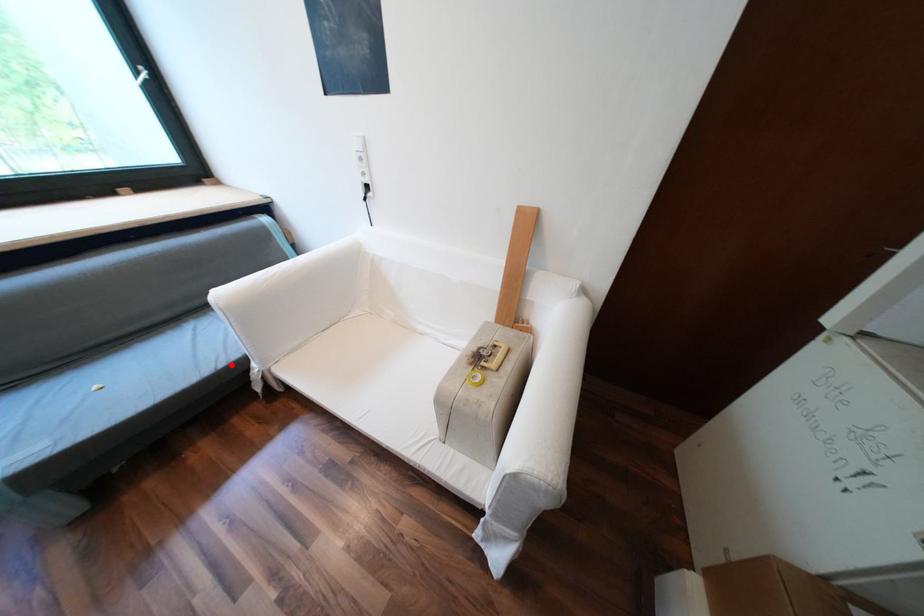
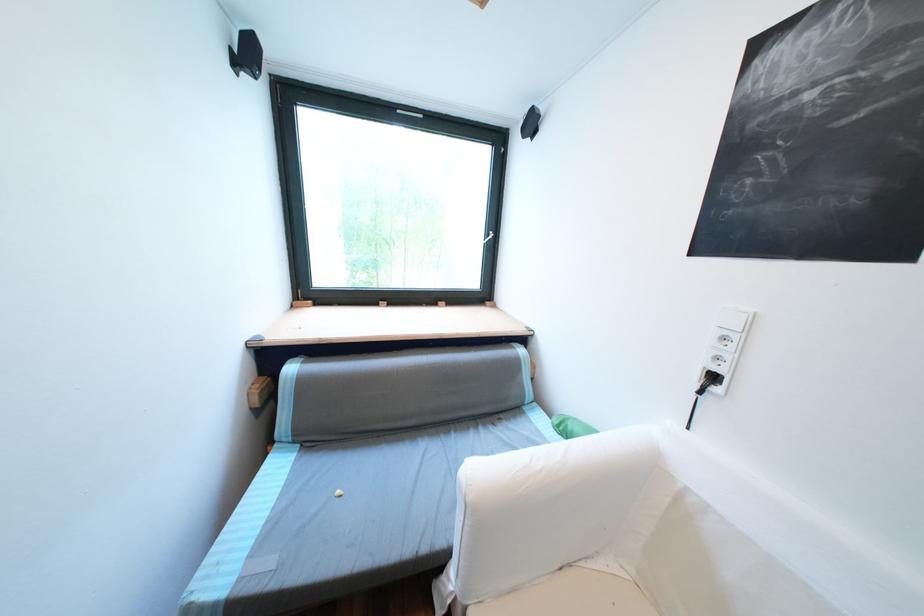
Question: I am providing you with two images of the same scene from different viewpoints. A red point is shown in image1. For the corresponding object point in image2, is it positioned nearer or farther from the camera?

Choices:
 (A) Nearer
 (B) Farther

Answer: (B)